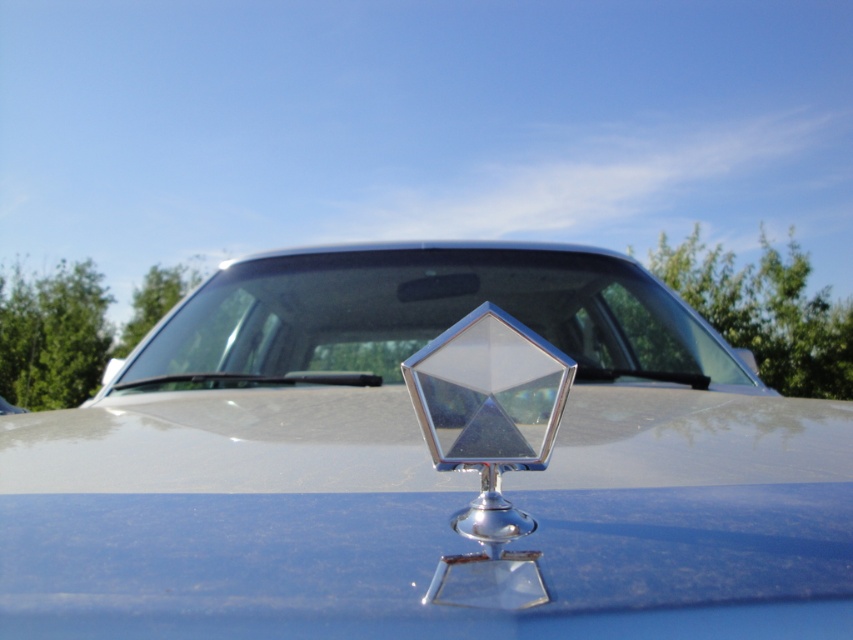
Question: Which of the following is the farthest from the observer?

Choices:
 (A) (369, 289)
 (B) (746, 468)

Answer: (A)

Question: Which point is closer to the camera?

Choices:
 (A) shiny chrome emblem at center
 (B) transparent glass windshield at center

Answer: (A)

Question: Where is shiny chrome emblem at center located in relation to transparent glass windshield at center in the image?

Choices:
 (A) right
 (B) left

Answer: (B)

Question: Is shiny chrome emblem at center positioned in front of transparent glass windshield at center?

Choices:
 (A) no
 (B) yes

Answer: (B)

Question: Can you confirm if shiny chrome emblem at center is bigger than transparent glass windshield at center?

Choices:
 (A) yes
 (B) no

Answer: (A)